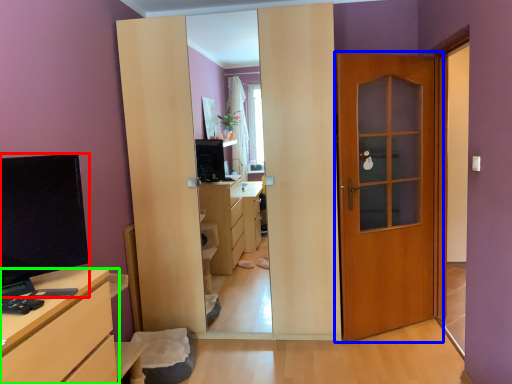
Question: Which object is the closest to the open (highlighted by a red box)? Choose among these: door (highlighted by a blue box) or chest of drawers (highlighted by a green box).

Choices:
 (A) door
 (B) chest of drawers

Answer: (B)